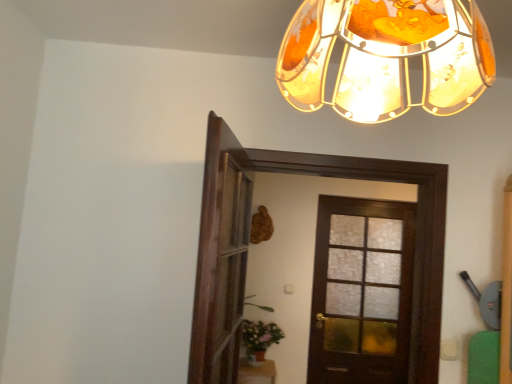
Question: Considering the positions of wooden screen door at center and green matte plant at lower center in the image, is wooden screen door at center taller or shorter than green matte plant at lower center?

Choices:
 (A) short
 (B) tall

Answer: (B)

Question: Choose the correct answer: Is wooden screen door at center inside green matte plant at lower center or outside it?

Choices:
 (A) outside
 (B) inside

Answer: (A)

Question: Which is nearer to the dark wood door at center, which is counted as the 1th door, starting from the front?

Choices:
 (A) translucent amber glass lampshade at upper center
 (B) green matte plant at lower center
 (C) wooden screen door at center
 (D) dark wood door at center, the 2th door in the front-to-back sequence

Answer: (C)

Question: Based on their relative distances, which object is nearer to the dark wood door at center, which is counted as the 1th door, starting from the front?

Choices:
 (A) green matte plant at lower center
 (B) wooden screen door at center
 (C) translucent amber glass lampshade at upper center
 (D) dark wood door at center, which is the first door from back to front

Answer: (B)